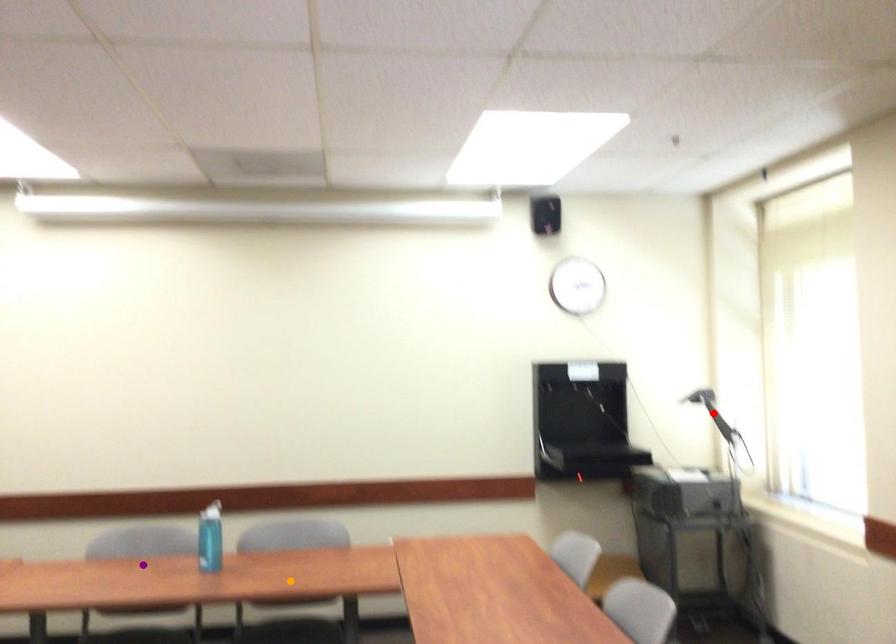
Order these from nearest to farthest:
1. orange point
2. red point
3. purple point

orange point < purple point < red point